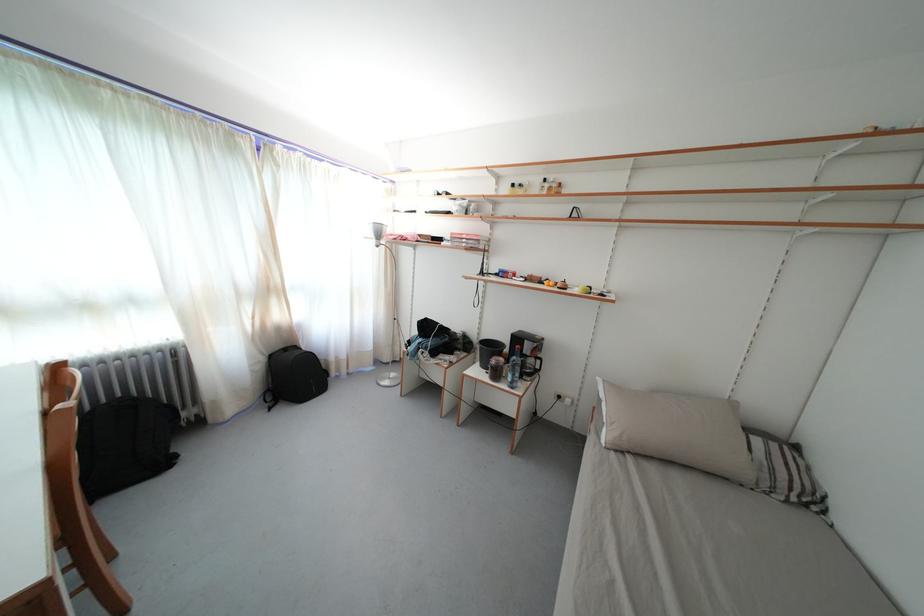
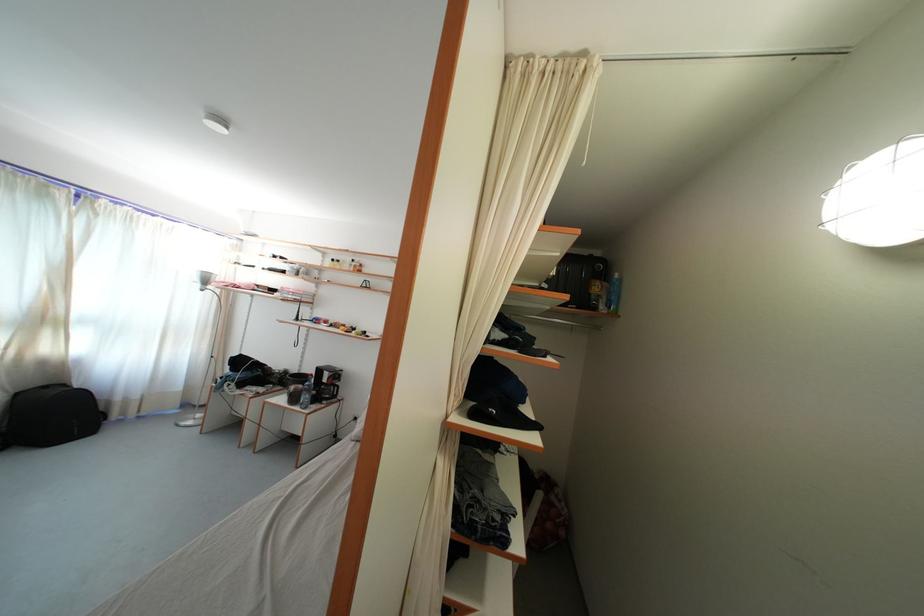
The point at (x=275, y=296) is marked in the first image. Where is the corresponding point in the second image?

(52, 326)